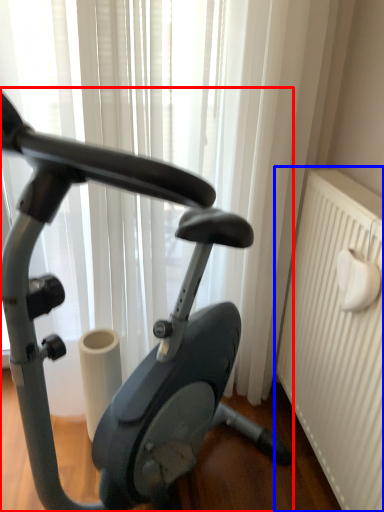
Question: Which point is closer to the camera, stationary bicycle (highlighted by a red box) or radiator (highlighted by a blue box)?

Choices:
 (A) stationary bicycle
 (B) radiator

Answer: (A)